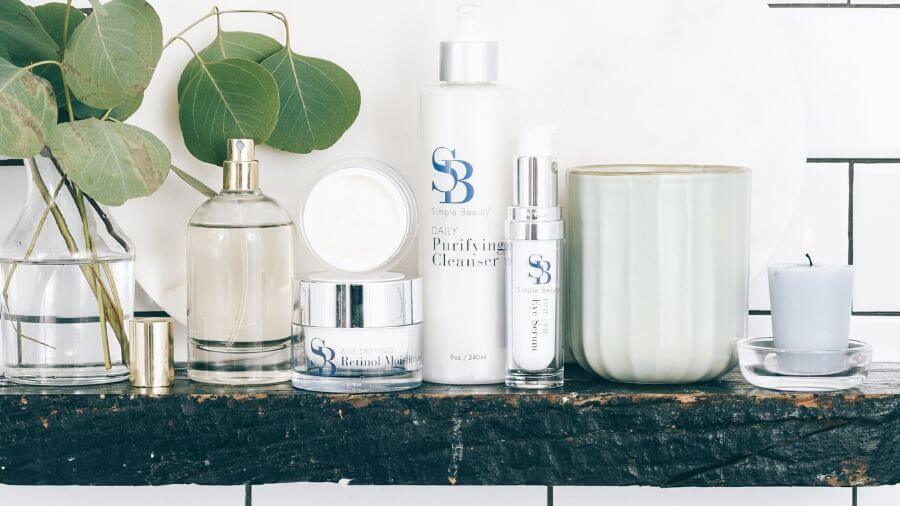
Identify the location of bottle. (249, 254), (475, 272), (380, 349), (517, 330).